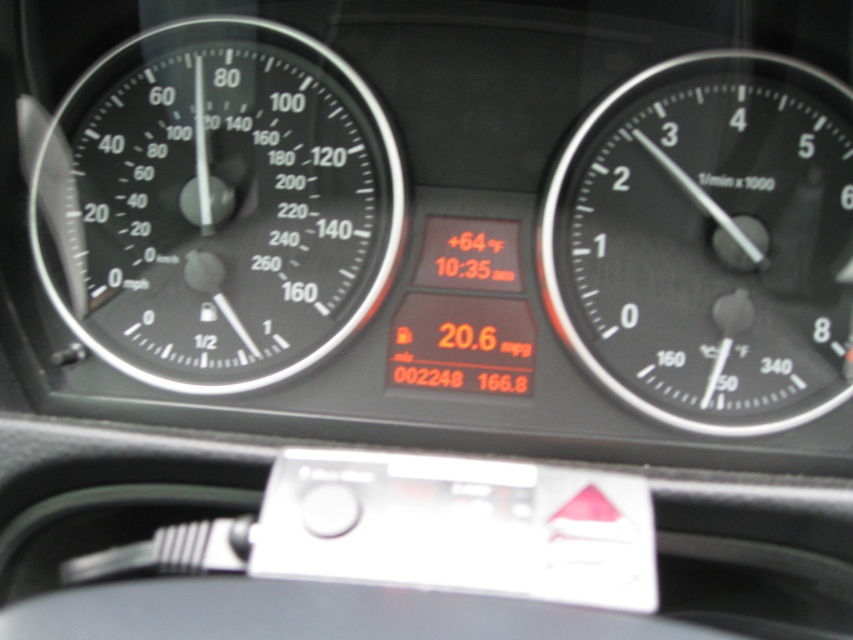
Question: Which point appears farthest from the camera in this image?

Choices:
 (A) tap(107, 179)
 (B) tap(558, 189)

Answer: (A)

Question: Which point appears farthest from the camera in this image?

Choices:
 (A) (740, 124)
 (B) (215, 20)

Answer: (B)

Question: Is black glass speedometer at left smaller than black matte tachometer at right?

Choices:
 (A) yes
 (B) no

Answer: (A)

Question: Is black glass speedometer at left smaller than black matte tachometer at right?

Choices:
 (A) no
 (B) yes

Answer: (B)

Question: Can you confirm if black glass speedometer at left is bigger than black matte tachometer at right?

Choices:
 (A) yes
 (B) no

Answer: (B)